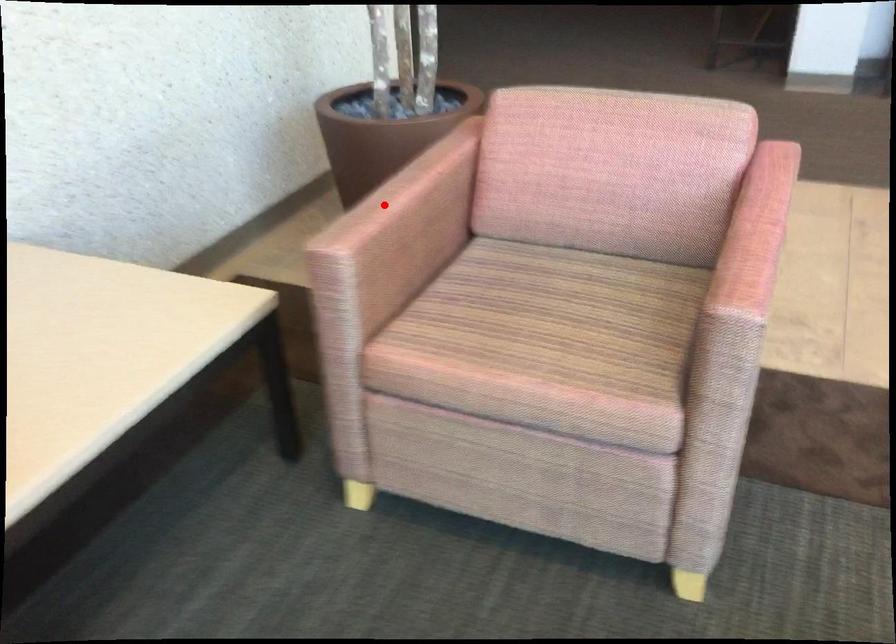
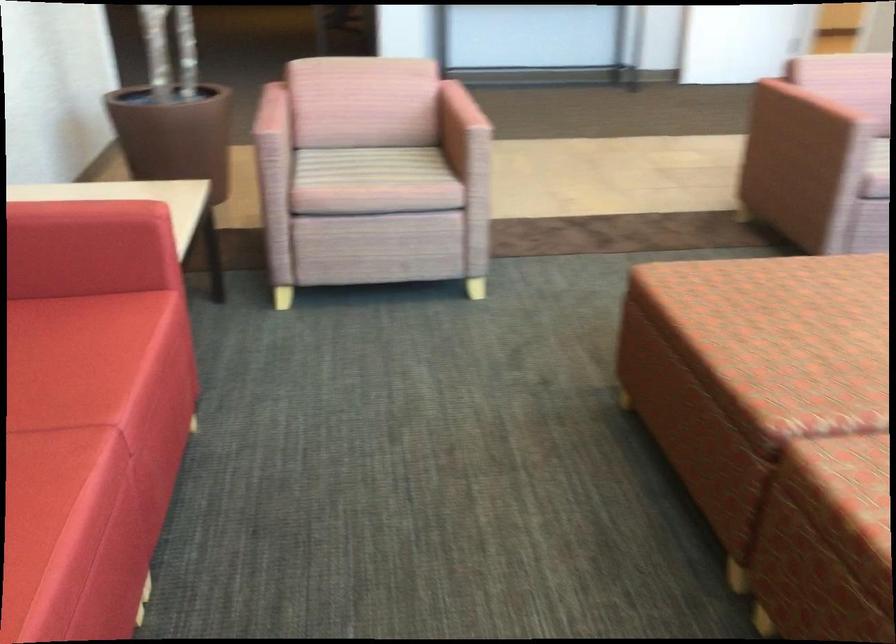
In the second image, find the point that corresponds to the highlighted location in the first image.

(271, 113)